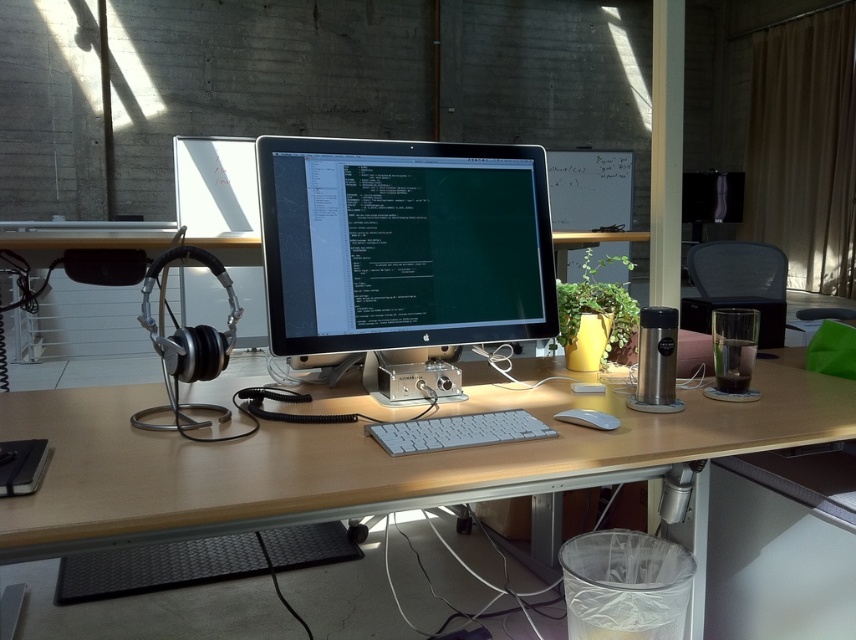
Question: Among these objects, which one is farthest from the camera?

Choices:
 (A) matte white desk at center
 (B) white plastic keyboard at center
 (C) satin black monitor at center
 (D) white matte mouse at center

Answer: (C)

Question: Which object is farther from the camera taking this photo?

Choices:
 (A) white plastic keyboard at center
 (B) satin black monitor at center

Answer: (B)

Question: Is matte white desk at center below white matte mouse at center?

Choices:
 (A) no
 (B) yes

Answer: (B)

Question: Considering the real-world distances, which object is closest to the white matte mouse at center?

Choices:
 (A) white plastic keyboard at center
 (B) matte white desk at center

Answer: (A)

Question: Can you confirm if satin black monitor at center is positioned to the right of white plastic keyboard at center?

Choices:
 (A) yes
 (B) no

Answer: (B)

Question: Observing the image, what is the correct spatial positioning of matte white desk at center in reference to satin black monitor at center?

Choices:
 (A) below
 (B) above

Answer: (A)